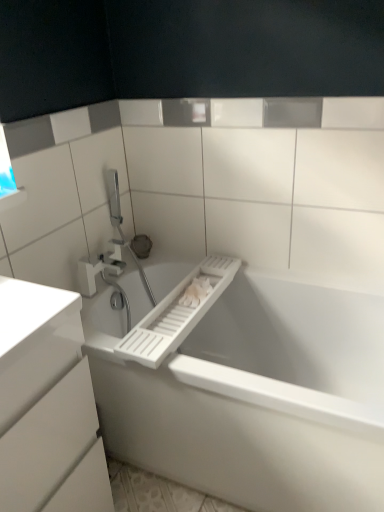
The image size is (384, 512). Describe the element at coordinates (100, 266) in the screenshot. I see `white plastic tap at upper left` at that location.

The width and height of the screenshot is (384, 512). What are the coordinates of `white plastic tap at upper left` in the screenshot? It's located at (100, 266).

Image resolution: width=384 pixels, height=512 pixels. I want to click on white plastic bathtub at lower left, so click(x=251, y=392).

Can you tell me how much white glossy cabinet at lower left and transparent glass window at upper left differ in facing direction?

The angle between the facing direction of white glossy cabinet at lower left and the facing direction of transparent glass window at upper left is 90.5 degrees.

Which is in front, white glossy cabinet at lower left or transparent glass window at upper left?

white glossy cabinet at lower left.

Is transparent glass window at upper left surrounded by white glossy cabinet at lower left?

No, transparent glass window at upper left is located outside of white glossy cabinet at lower left.

Does white plastic bathtub at lower left have a smaller size compared to white glossy cabinet at lower left?

Actually, white plastic bathtub at lower left might be larger than white glossy cabinet at lower left.

Considering the points (145, 332) and (52, 478), which point is in front, point (145, 332) or point (52, 478)?

The point (52, 478) is in front.

From the image's perspective, is white plastic bathtub at lower left below white glossy cabinet at lower left?

No, from the image's perspective, white plastic bathtub at lower left is not beneath white glossy cabinet at lower left.

Is white plastic bathtub at lower left thinner than white glossy cabinet at lower left?

In fact, white plastic bathtub at lower left might be wider than white glossy cabinet at lower left.

From their relative heights in the image, would you say white plastic tap at upper left is taller or shorter than white plastic towel bar at center?

Clearly, white plastic tap at upper left is taller compared to white plastic towel bar at center.

Is white plastic tap at upper left completely or partially outside of white plastic towel bar at center?

Yes.

Is white plastic towel bar at center at the back of white plastic tap at upper left?

No, white plastic towel bar at center is not at the back of white plastic tap at upper left.

Consider the image. From the image's perspective, which is above, white plastic tap at upper left or white plastic towel bar at center?

white plastic tap at upper left appears higher in the image.

From a real-world perspective, between white plastic bathtub at lower left and white plastic towel bar at center, who is vertically lower?

From a 3D spatial view, white plastic bathtub at lower left is below.

Is white plastic bathtub at lower left directly adjacent to white plastic towel bar at center?

There is a gap between white plastic bathtub at lower left and white plastic towel bar at center.

Does point (293, 490) come behind point (130, 353)?

No, (293, 490) is in front of (130, 353).

In the scene shown: From a real-world perspective, does white glossy cabinet at lower left sit lower than white plastic tap at upper left?

Yes, from a real-world perspective, white glossy cabinet at lower left is beneath white plastic tap at upper left.

Which of these two, white glossy cabinet at lower left or white plastic tap at upper left, is wider?

With larger width is white glossy cabinet at lower left.

Is white glossy cabinet at lower left positioned in front of white plastic tap at upper left?

Yes, it is in front of white plastic tap at upper left.

How different are the orientations of white glossy cabinet at lower left and white plastic tap at upper left in degrees?

There is a 1.05-degree angle between the facing directions of white glossy cabinet at lower left and white plastic tap at upper left.

Are white plastic bathtub at lower left and transparent glass window at upper left located far from each other?

No, white plastic bathtub at lower left is not far away from transparent glass window at upper left.

Based on the photo, could you tell me if white plastic bathtub at lower left is turned towards transparent glass window at upper left?

No, white plastic bathtub at lower left is not aimed at transparent glass window at upper left.

Consider the image. Relative to transparent glass window at upper left, is white plastic bathtub at lower left in front or behind?

white plastic bathtub at lower left is in front of transparent glass window at upper left.

Consider the image. Considering the sizes of objects white plastic bathtub at lower left and transparent glass window at upper left in the image provided, who is wider, white plastic bathtub at lower left or transparent glass window at upper left?

Wider between the two is white plastic bathtub at lower left.

Where is `window above the white plastic tap at upper left (from a real-world perspective)`? The width and height of the screenshot is (384, 512). window above the white plastic tap at upper left (from a real-world perspective) is located at coordinates (5, 168).

From a real-world perspective, which object stands above the other?

From a 3D spatial view, transparent glass window at upper left is above.

Who is bigger, transparent glass window at upper left or white plastic tap at upper left?

Bigger between the two is white plastic tap at upper left.

Can you tell me how much transparent glass window at upper left and white plastic tap at upper left differ in facing direction?

89.5 degrees.

Find the location of a particular element. The height and width of the screenshot is (512, 384). bathroom cabinet below the transparent glass window at upper left (from the image's perspective) is located at coordinates (46, 402).

Identify the location of bathtub on the right of white glossy cabinet at lower left. The image size is (384, 512). (251, 392).

Considering their positions, is white plastic tap at upper left positioned closer to white plastic bathtub at lower left than white plastic towel bar at center?

white plastic towel bar at center lies closer to white plastic bathtub at lower left than the other object.

Which object lies further to the anchor point white plastic bathtub at lower left, white plastic tap at upper left or transparent glass window at upper left?

transparent glass window at upper left is further to white plastic bathtub at lower left.

Looking at the image, which one is located further to transparent glass window at upper left, white glossy cabinet at lower left or white plastic bathtub at lower left?

The object further to transparent glass window at upper left is white plastic bathtub at lower left.

When comparing their distances from white plastic towel bar at center, does white plastic bathtub at lower left or white plastic tap at upper left seem closer?

white plastic bathtub at lower left.

From the image, which object appears to be farther from white plastic towel bar at center, white plastic bathtub at lower left or transparent glass window at upper left?

transparent glass window at upper left.

When comparing their distances from white plastic tap at upper left, does transparent glass window at upper left or white plastic towel bar at center seem further?

transparent glass window at upper left is further to white plastic tap at upper left.

Based on their spatial positions, is white glossy cabinet at lower left or white plastic towel bar at center closer to transparent glass window at upper left?

white glossy cabinet at lower left.

Considering their positions, is transparent glass window at upper left positioned closer to white glossy cabinet at lower left than white plastic towel bar at center?

The object closer to white glossy cabinet at lower left is white plastic towel bar at center.

I want to click on towel bar between white glossy cabinet at lower left and white plastic bathtub at lower left, so click(176, 314).

Image resolution: width=384 pixels, height=512 pixels. In order to click on tap between transparent glass window at upper left and white plastic bathtub at lower left in the horizontal direction in this screenshot , I will do click(x=100, y=266).

Image resolution: width=384 pixels, height=512 pixels. Find the location of `bathtub between white glossy cabinet at lower left and white plastic tap at upper left in the front-back direction`. bathtub between white glossy cabinet at lower left and white plastic tap at upper left in the front-back direction is located at coordinates (251, 392).

I want to click on bathtub between transparent glass window at upper left and white glossy cabinet at lower left in the up-down direction, so [x=251, y=392].